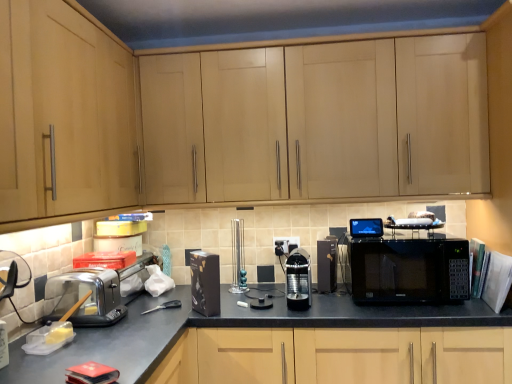
Question: Does black matte box at center, marked as the 1th appliance in a left-to-right arrangement, have a lesser width compared to black glossy microwave at center?

Choices:
 (A) yes
 (B) no

Answer: (A)

Question: Is black matte box at center, marked as the 1th appliance in a left-to-right arrangement, with black glossy microwave at center?

Choices:
 (A) yes
 (B) no

Answer: (B)

Question: From a real-world perspective, is black matte box at center, marked as the 1th appliance in a left-to-right arrangement, located beneath black glossy microwave at center?

Choices:
 (A) yes
 (B) no

Answer: (A)

Question: From a real-world perspective, is black matte box at center, the fourth appliance from the right, physically above black glossy microwave at center?

Choices:
 (A) no
 (B) yes

Answer: (A)

Question: Does black matte box at center, the fourth appliance from the right, have a smaller size compared to black glossy microwave at center?

Choices:
 (A) yes
 (B) no

Answer: (A)

Question: Looking at their shapes, would you say metallic teal candlesticks at center, arranged as the 2th appliance when viewed from the left, is wider or thinner than light wood cabinet at left, which is the second cabinetry in back-to-front order?

Choices:
 (A) thin
 (B) wide

Answer: (A)

Question: Would you say metallic teal candlesticks at center, arranged as the 2th appliance when viewed from the left, is inside or outside light wood cabinet at left, acting as the second cabinetry starting from the right?

Choices:
 (A) inside
 (B) outside

Answer: (B)

Question: From the image's perspective, is metallic teal candlesticks at center, positioned as the third appliance in right-to-left order, above or below light wood cabinet at left, the 1th cabinetry from the left?

Choices:
 (A) below
 (B) above

Answer: (A)

Question: Does point (241, 254) appear closer or farther from the camera than point (103, 180)?

Choices:
 (A) closer
 (B) farther

Answer: (B)

Question: Is clear plastic toaster at lower left wider or thinner than black plastic coffee machine at center, placed as the fourth appliance when sorted from left to right?

Choices:
 (A) thin
 (B) wide

Answer: (B)

Question: Do you think clear plastic toaster at lower left is within black plastic coffee machine at center, placed as the fourth appliance when sorted from left to right, or outside of it?

Choices:
 (A) outside
 (B) inside

Answer: (A)

Question: From a real-world perspective, is clear plastic toaster at lower left physically located above or below black plastic coffee machine at center, placed as the fourth appliance when sorted from left to right?

Choices:
 (A) above
 (B) below

Answer: (B)

Question: In the image, is clear plastic toaster at lower left on the left side or the right side of black plastic coffee machine at center, placed as the fourth appliance when sorted from left to right?

Choices:
 (A) right
 (B) left

Answer: (B)

Question: Is light wood cabinet at upper center, which appears as the 2th cabinetry when viewed from the front, to the left or to the right of light wood cabinet at left, acting as the second cabinetry starting from the right, in the image?

Choices:
 (A) left
 (B) right

Answer: (B)

Question: Is light wood cabinet at upper center, which appears as the 2th cabinetry when viewed from the front, taller or shorter than light wood cabinet at left, which is the second cabinetry in back-to-front order?

Choices:
 (A) tall
 (B) short

Answer: (B)